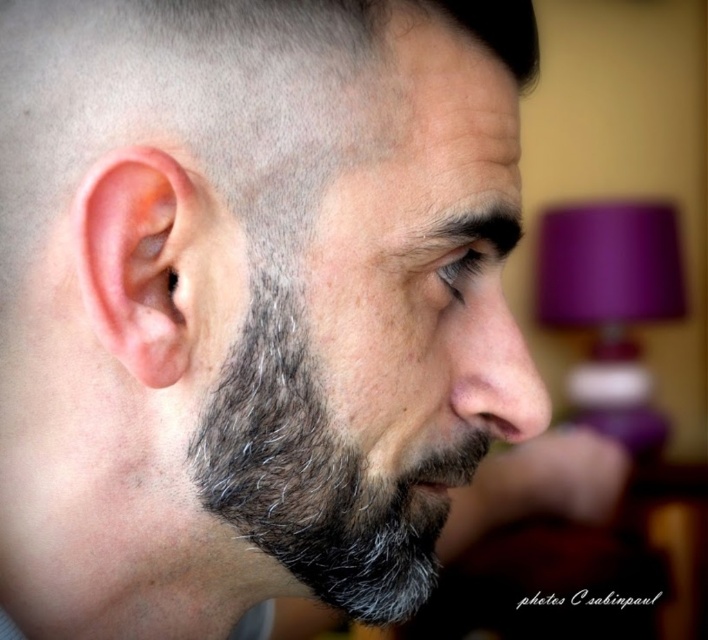
You are a photographer adjusting your camera focus. You notice a point at coordinates (316,472) in the image. What object is located at that point?

The point at coordinates (316,472) is where the gray fuzzy beard at center is located.